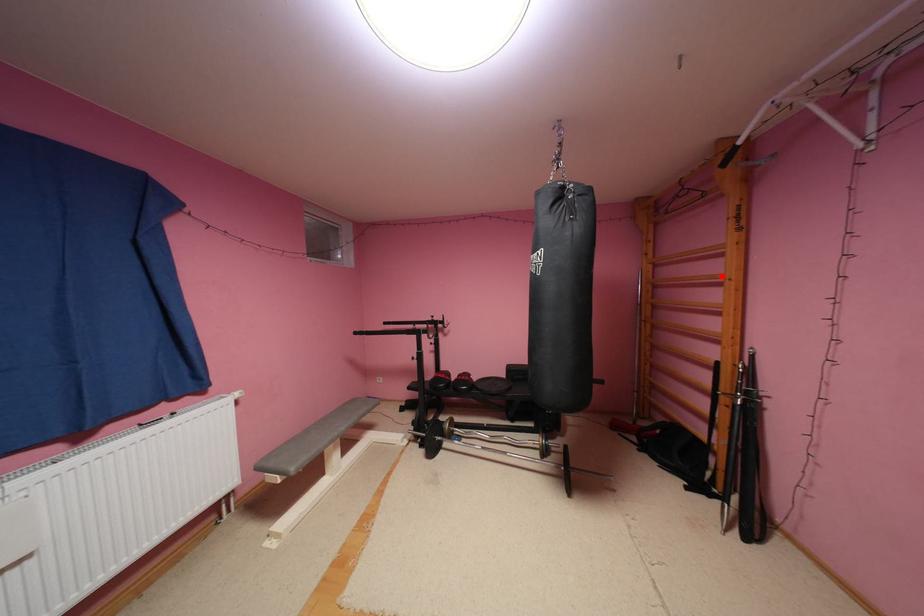
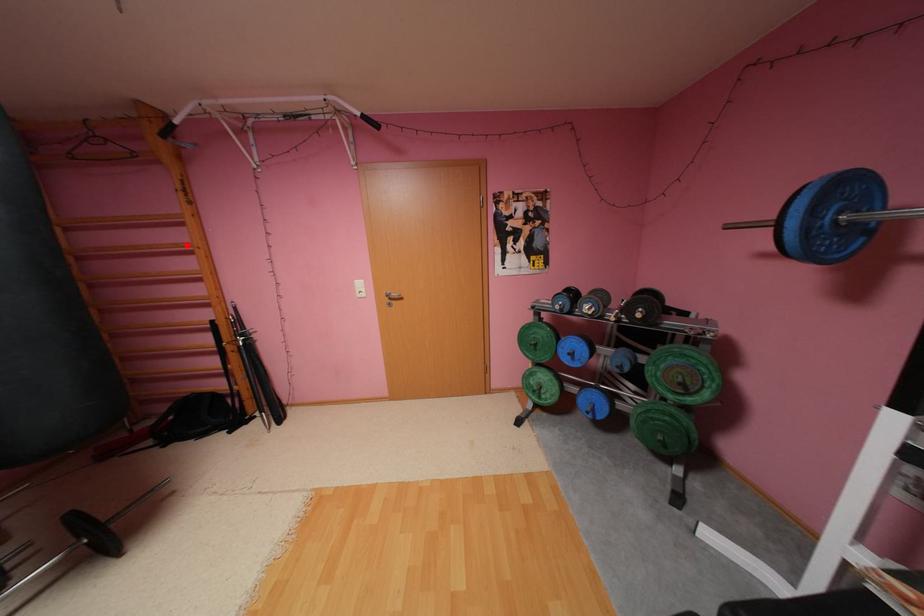
Looking at this image, I am providing you with two images of the same scene from different viewpoints. A red point is marked on the first image and another point is marked on the second image. Is the red point in image1 aligned with the point shown in image2?

Yes